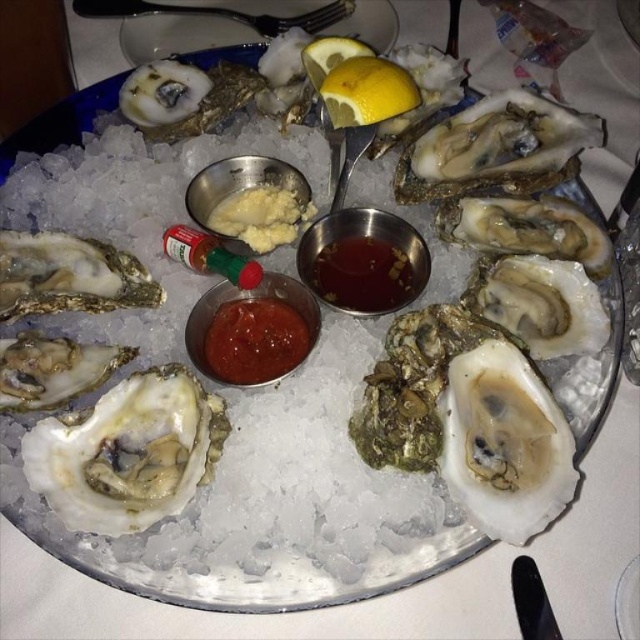
You are a food critic inspecting the oyster platter. You notice two points on the plate labeled as point 1 at coordinates [444,445] and point 2 at coordinates [317,314]. Based on the arrangement of the oysters and condiments, which point is closer to you?

Point 1 at coordinates [444,445] is closer to the viewer than point 2 at coordinates [317,314].

You are a food critic evaluating the presentation of this oyster dish. The plate has a translucent amber liquid at center and a yellow matte lemon at upper center. Which condiment occupies more horizontal space on the plate?

The translucent amber liquid at center might be wider than yellow matte lemon at upper center, so it likely occupies more horizontal space.